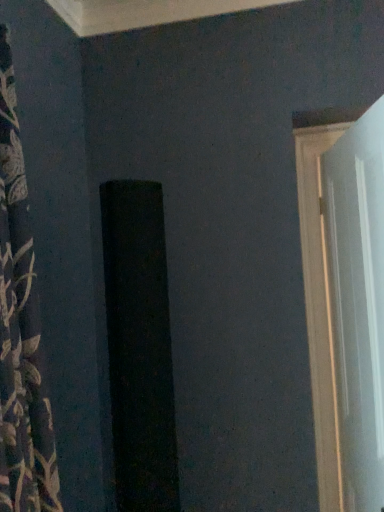
Question: Should I look upward or downward to see white glossy door at right?

Choices:
 (A) down
 (B) up

Answer: (A)

Question: Is white glossy door at right smaller than floral fabric curtain at left?

Choices:
 (A) yes
 (B) no

Answer: (A)

Question: Is white glossy door at right looking in the opposite direction of floral fabric curtain at left?

Choices:
 (A) no
 (B) yes

Answer: (B)

Question: From a real-world perspective, is white glossy door at right located higher than floral fabric curtain at left?

Choices:
 (A) yes
 (B) no

Answer: (B)

Question: Is white glossy door at right at the left side of floral fabric curtain at left?

Choices:
 (A) yes
 (B) no

Answer: (B)

Question: Does white glossy door at right have a greater height compared to floral fabric curtain at left?

Choices:
 (A) yes
 (B) no

Answer: (A)

Question: Does white glossy door at right have a greater width compared to floral fabric curtain at left?

Choices:
 (A) yes
 (B) no

Answer: (B)

Question: Is floral fabric curtain at left outside of white glossy door at right?

Choices:
 (A) no
 (B) yes

Answer: (B)

Question: Is floral fabric curtain at left to the left of white glossy door at right from the viewer's perspective?

Choices:
 (A) no
 (B) yes

Answer: (B)

Question: Is floral fabric curtain at left oriented towards white glossy door at right?

Choices:
 (A) yes
 (B) no

Answer: (B)

Question: Can you confirm if floral fabric curtain at left is wider than white glossy door at right?

Choices:
 (A) no
 (B) yes

Answer: (B)

Question: From a real-world perspective, is floral fabric curtain at left below white glossy door at right?

Choices:
 (A) yes
 (B) no

Answer: (B)

Question: Does floral fabric curtain at left have a lesser width compared to white glossy door at right?

Choices:
 (A) no
 (B) yes

Answer: (A)

Question: From a real-world perspective, is white glossy door at right positioned above or below floral fabric curtain at left?

Choices:
 (A) above
 (B) below

Answer: (B)